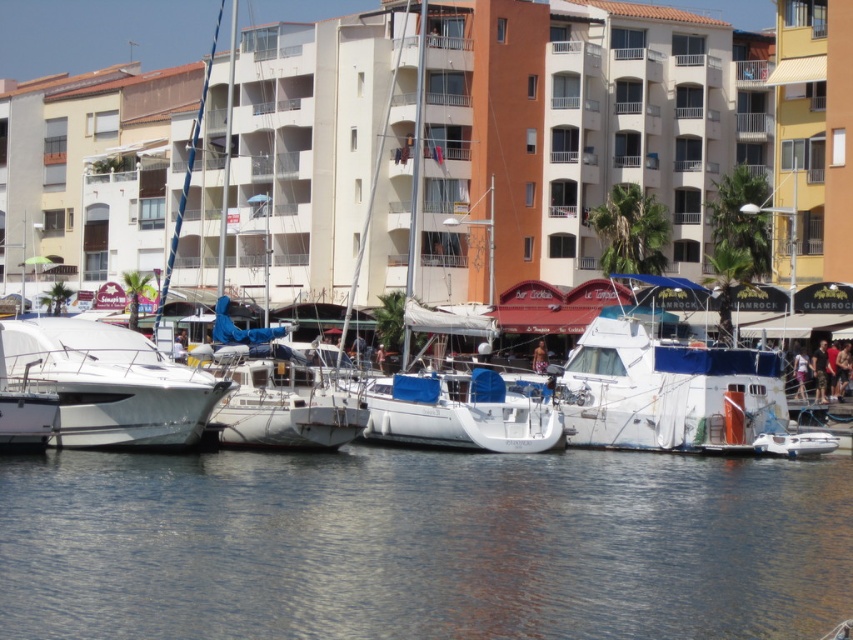
Can you confirm if white glossy boat at left is positioned to the left of white matte sailboat at center?

Indeed, white glossy boat at left is positioned on the left side of white matte sailboat at center.

Is point (144, 444) farther from camera compared to point (517, 442)?

No.

Locate an element on the screen. white glossy boat at left is located at coordinates (109, 385).

Can you confirm if white smooth building at center is positioned to the left of white matte sailboat at center?

Indeed, white smooth building at center is positioned on the left side of white matte sailboat at center.

Can you confirm if white smooth building at center is thinner than white matte sailboat at center?

No, white smooth building at center is not thinner than white matte sailboat at center.

You are a GUI agent. You are given a task and a screenshot of the screen. Output one action in this format:
    pyautogui.click(x=<x>, y=<y>)
    Task: Click on the white smooth building at center
    
    Given the screenshot: What is the action you would take?
    pyautogui.click(x=432, y=150)

Locate an element on the screen. white smooth building at center is located at coordinates (432, 150).

Can you confirm if transparent water at lower center is positioned to the left of white matte boat at center?

Indeed, transparent water at lower center is positioned on the left side of white matte boat at center.

What do you see at coordinates (422, 545) in the screenshot?
I see `transparent water at lower center` at bounding box center [422, 545].

Is point (701, 502) farther from camera compared to point (630, 305)?

No, it is in front of (630, 305).

Locate an element on the screen. transparent water at lower center is located at coordinates (422, 545).